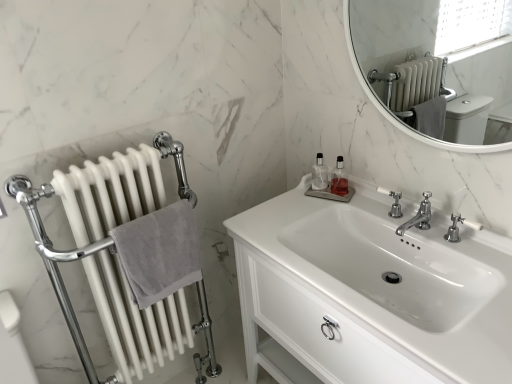
Find the location of a particular element. free area in between clear glass bottle at upper center, marked as the first toiletry in a left-to-right arrangement, and polished chrome faucet at upper right is located at coordinates (355, 207).